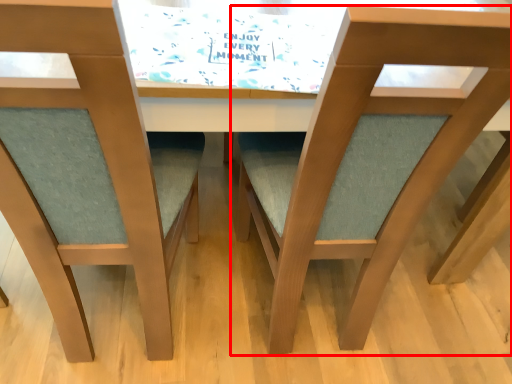
Question: From the image's perspective, considering the relative positions of chair (annotated by the red box) and chair in the image provided, where is chair (annotated by the red box) located with respect to the staircase?

Choices:
 (A) above
 (B) below

Answer: (B)